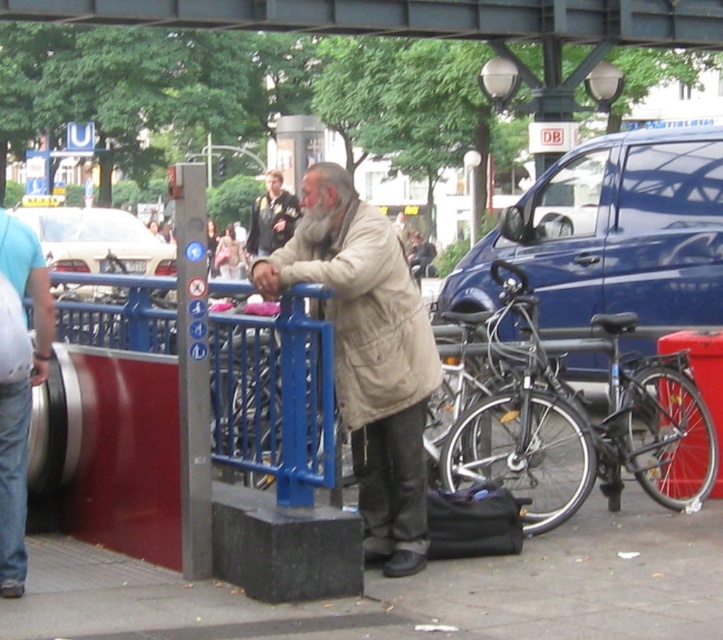
Question: Considering the real-world distances, which object is closest to the light blue denim jeans at lower left?

Choices:
 (A) black concrete pavement at lower center
 (B) white glossy car at upper left

Answer: (A)

Question: Is white glossy car at upper left positioned at the back of light brown leather jacket at center?

Choices:
 (A) yes
 (B) no

Answer: (B)

Question: Which object appears closest to the camera in this image?

Choices:
 (A) silver metallic bicycle at center
 (B) light brown leather jacket at center
 (C) blue metal fence at left

Answer: (C)

Question: Can you confirm if black concrete pavement at lower center is bigger than white glossy car at upper left?

Choices:
 (A) yes
 (B) no

Answer: (B)

Question: Which object appears farthest from the camera in this image?

Choices:
 (A) light blue denim jeans at lower left
 (B) blue metal fence at left

Answer: (A)

Question: Is metallic gray bridge at upper center positioned in front of gray matte beard at center?

Choices:
 (A) yes
 (B) no

Answer: (B)